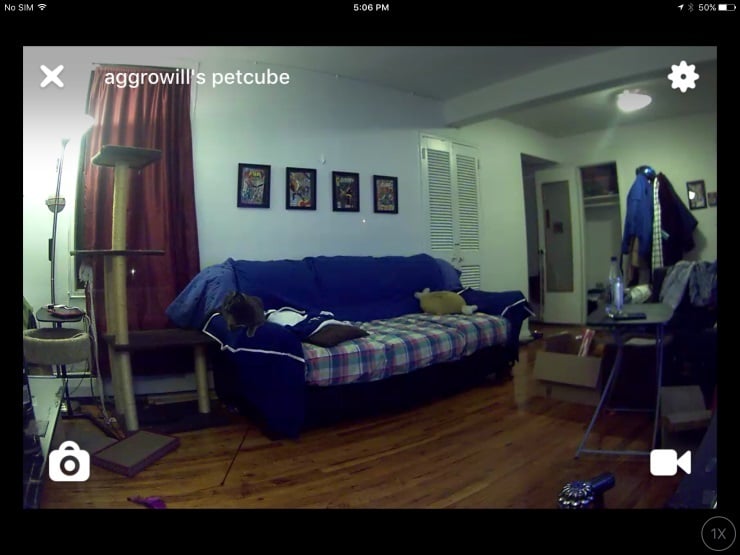
Find the location of a particular element. cat scratching pad with purple sides is located at coordinates (86, 441), (132, 458).